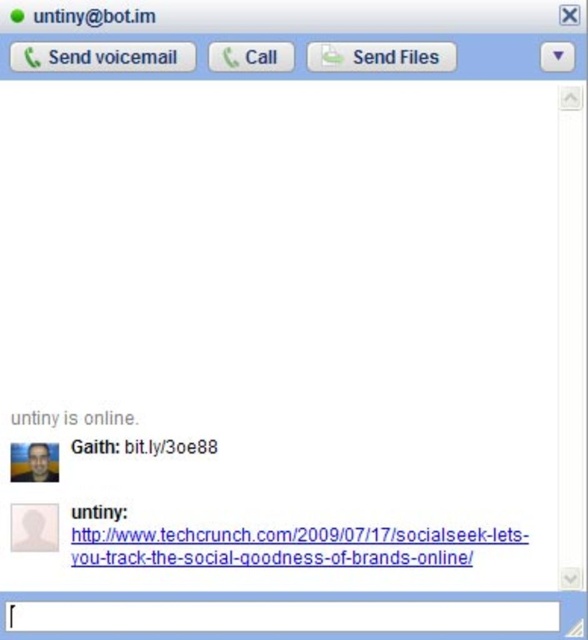
Which of these two, gray text at center or black text at upper center, stands taller?

gray text at center

Describe the element at coordinates (71, 419) in the screenshot. I see `gray text at center` at that location.

Identify the location of gray text at center. 71,419.

Is black link at center further to camera compared to matte black text at upper left?

Yes.

Between point (81, 452) and point (64, 10), which one is positioned behind?

The point (81, 452) is more distant.

Is point (195, 449) positioned in front of point (99, 10)?

No, it is not.

The image size is (588, 640). I want to click on black link at center, so click(x=171, y=445).

The width and height of the screenshot is (588, 640). What do you see at coordinates (93, 17) in the screenshot?
I see `matte black text at upper left` at bounding box center [93, 17].

Is matte black text at upper left wider than gray text at center?

No.

Based on the photo, measure the distance between point (115, 16) and camera.

Point (115, 16) is 4.37 feet away from camera.

This screenshot has width=588, height=640. What are the coordinates of `matte black text at upper left` in the screenshot? It's located at (93, 17).